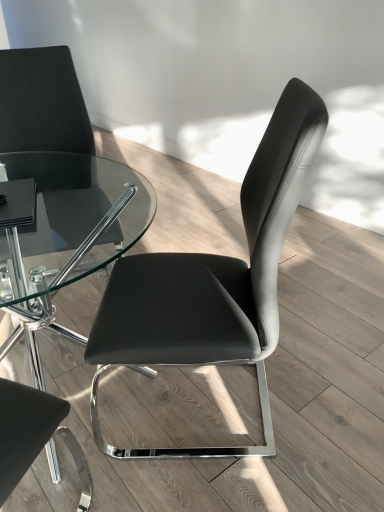
Question: Is black leather chair at upper left, which ranks as the second chair in right-to-left order, shorter than black leather chair at center, the first chair viewed from the right?

Choices:
 (A) yes
 (B) no

Answer: (B)

Question: From the image's perspective, is black leather chair at upper left, the first chair in the left-to-right sequence, located beneath black leather chair at center, the first chair viewed from the right?

Choices:
 (A) no
 (B) yes

Answer: (A)

Question: Is the depth of black leather chair at upper left, the first chair in the left-to-right sequence, greater than that of black leather chair at center, which is the 2th chair from left to right?

Choices:
 (A) no
 (B) yes

Answer: (B)

Question: Is black leather chair at upper left, the first chair in the left-to-right sequence, not inside black leather chair at center, the first chair viewed from the right?

Choices:
 (A) yes
 (B) no

Answer: (A)

Question: Is black leather chair at upper left, which ranks as the second chair in right-to-left order, positioned in front of black leather chair at center, which is the 2th chair from left to right?

Choices:
 (A) yes
 (B) no

Answer: (B)

Question: Is black leather chair at upper left, which ranks as the second chair in right-to-left order, facing towards black leather chair at center, which is the 2th chair from left to right?

Choices:
 (A) yes
 (B) no

Answer: (A)

Question: Is black leather chair at upper left, the first chair in the left-to-right sequence, at the back of black leather chair at center, which is the 2th chair from left to right?

Choices:
 (A) yes
 (B) no

Answer: (B)

Question: Is black leather chair at center, the first chair viewed from the right, further to camera compared to black leather chair at upper left, the first chair in the left-to-right sequence?

Choices:
 (A) no
 (B) yes

Answer: (A)

Question: Considering the relative sizes of black leather chair at center, which is the 2th chair from left to right, and black leather chair at upper left, the first chair in the left-to-right sequence, in the image provided, is black leather chair at center, which is the 2th chair from left to right, wider than black leather chair at upper left, the first chair in the left-to-right sequence,?

Choices:
 (A) no
 (B) yes

Answer: (B)

Question: Does black leather chair at center, the first chair viewed from the right, have a larger size compared to black leather chair at upper left, which ranks as the second chair in right-to-left order?

Choices:
 (A) yes
 (B) no

Answer: (B)

Question: Is black leather chair at center, which is the 2th chair from left to right, oriented towards black leather chair at upper left, the first chair in the left-to-right sequence?

Choices:
 (A) no
 (B) yes

Answer: (A)

Question: From a real-world perspective, is black leather chair at center, which is the 2th chair from left to right, beneath black leather chair at upper left, the first chair in the left-to-right sequence?

Choices:
 (A) yes
 (B) no

Answer: (B)

Question: Is black leather chair at center, which is the 2th chair from left to right, inside the boundaries of black leather chair at upper left, which ranks as the second chair in right-to-left order, or outside?

Choices:
 (A) outside
 (B) inside

Answer: (A)